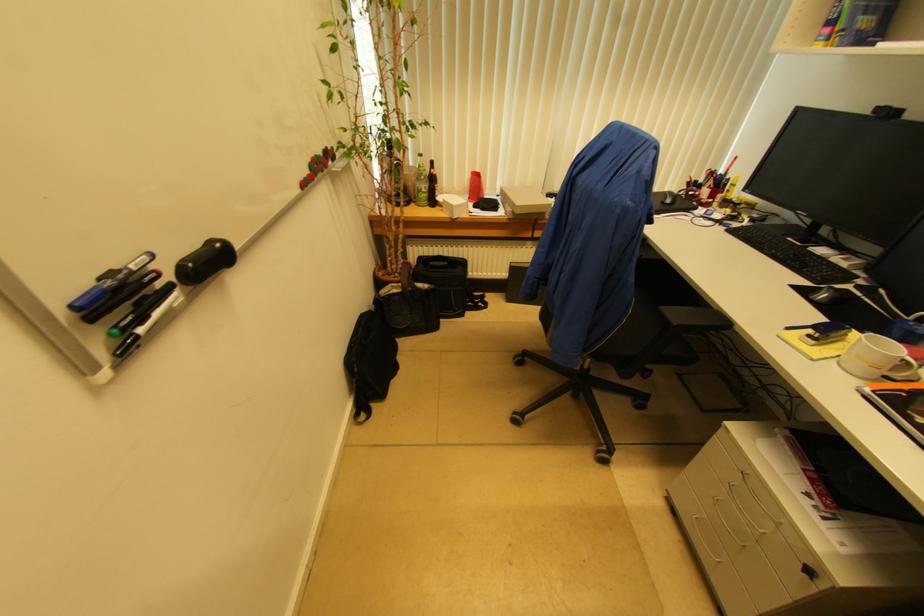
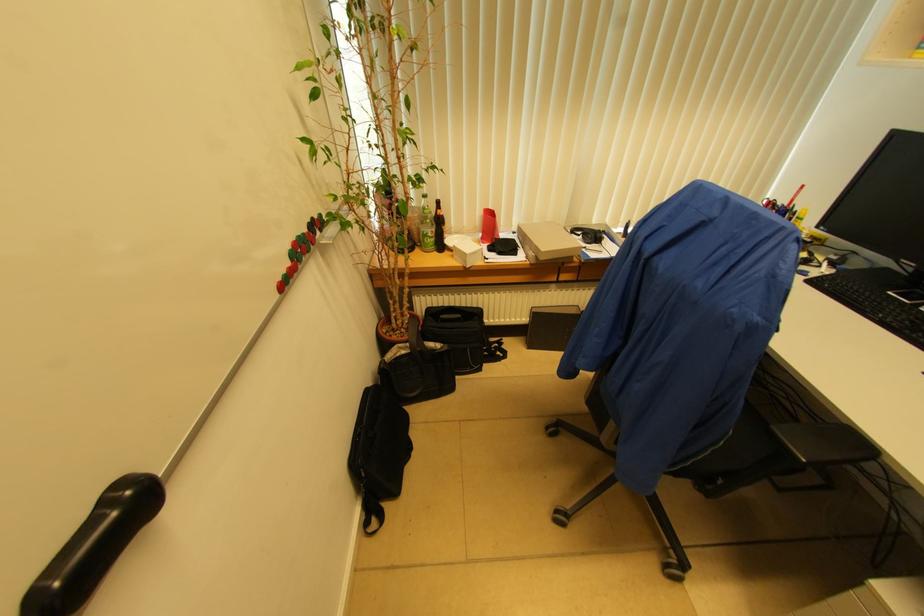
Question: Which direction would the cameraman need to move to produce the second image? Reply with the corresponding letter.

Choices:
 (A) Left
 (B) Right
 (C) Forward
 (D) Backward

Answer: (C)